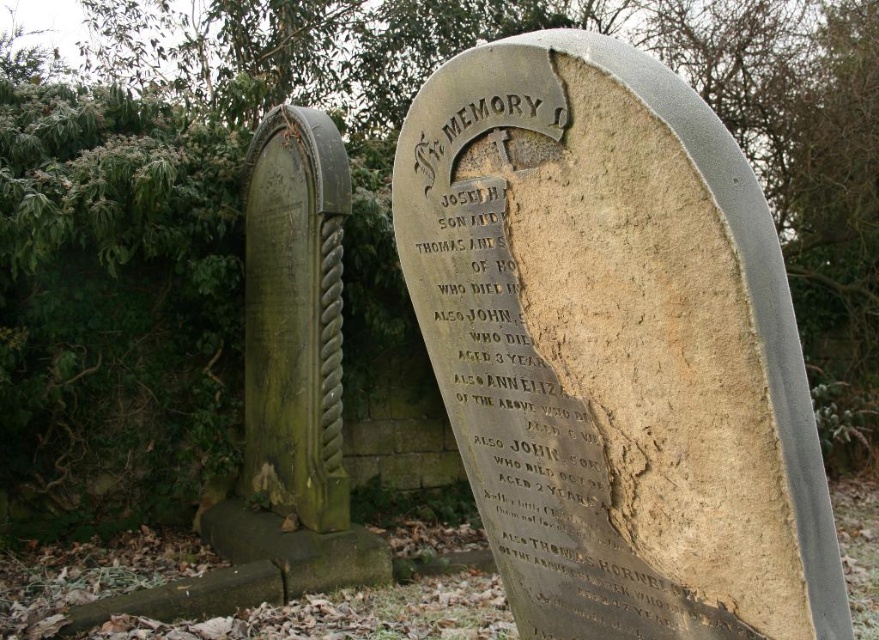
You are a groundskeeper responsible for maintaining the cemetery. You need to place a new flowerpot between the stone tombstone at center and the green stone monument at left. The flowerpot requires a space of 1.5 meters. Is there enough space between them to place the flowerpot?

The distance between the stone tombstone at center and the green stone monument at left is 2.80 meters. Since the flowerpot requires 1.5 meters of space, there is sufficient room to place it between them.

Based on the photo, you are a historian examining two gravestones in a cemetery. You notice the stone tombstone at center and the green stone monument at left. Which one has a smaller width?

The stone tombstone at center is thinner than the green stone monument at left, so the stone tombstone at center has a smaller width.

You are standing in a cemetery and want to take a photo of the stone tombstone at center. If your camera has a minimum focusing distance of 5 feet, will you be able to take a clear photo without moving closer?

The stone tombstone at center and camera are 4.88 feet apart. Since the minimum focusing distance is 5 feet, you are slightly too close to focus properly. Move back a few inches to ensure the camera can focus.